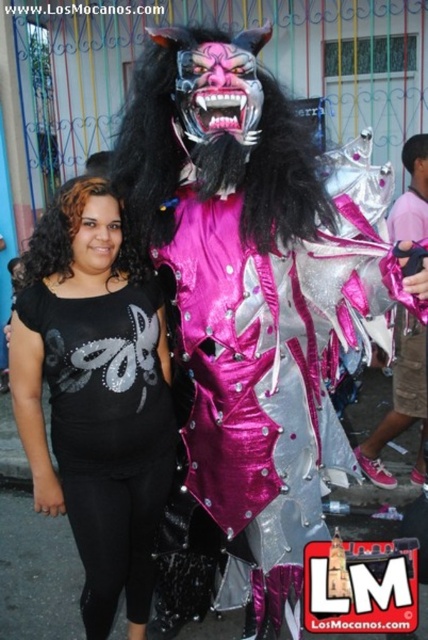
You need to determine which object is smaller between the black matte leggings at lower left and the shiny silver costume at right based on the scene description. Which one is smaller?

The black matte leggings at lower left is smaller than the shiny silver costume at right according to the description.

You are standing at the point marked as point (x=23, y=292) and want to take a photo of the two people in front of the building. The camera you have can focus on subjects within 6 feet. Will the camera be able to focus on the two people?

The distance between point (x=23, y=292) and the camera is 6.62 feet. Since the camera can focus within 6 feet, the distance is slightly beyond its focusing range. Therefore, the camera may not be able to focus properly on the two people.

You are a photographer setting up a shoot. You need to place a light source so that it illuminates both the black matte leggings at lower left and the shiny silver costume at right equally. Considering their positions, where should you position the light source relative to the two objects?

The black matte leggings at lower left is below the shiny silver costume at right. To illuminate both equally, position the light source above and centered between them so that the light reaches both the lower and upper positions effectively.